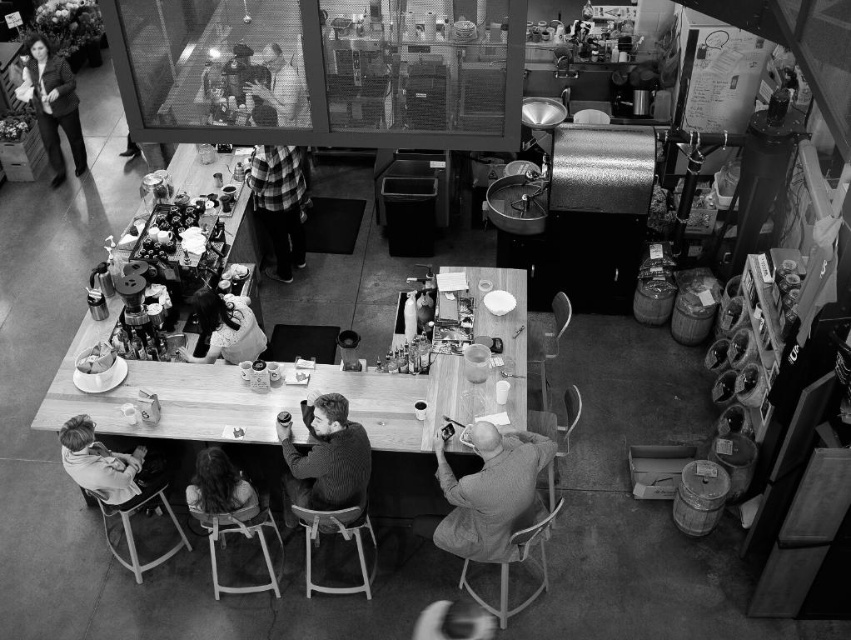
You are a delivery person standing at the entrance of the coffee shop, and you need to deliver a package to the knitted sweater at center and the matte black jacket at upper left. The delivery robot you have can only travel 5.5 meters. Can it reach both locations without needing to recharge?

The knitted sweater at center is 6.10 meters from the matte black jacket at upper left. Since the distance between them is greater than the robot can travel in one charge, it cannot reach both locations without recharging.